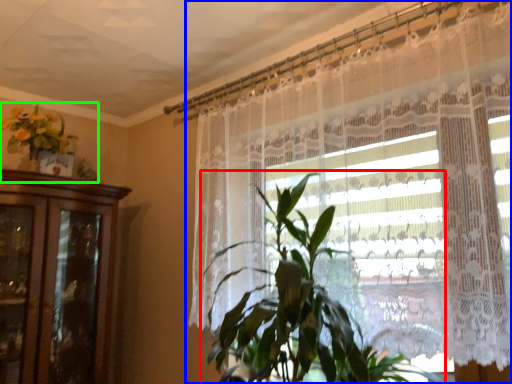
Question: Which object is the closest to the houseplant (highlighted by a red box)? Choose among these: curtain (highlighted by a blue box) or floral arrangement (highlighted by a green box).

Choices:
 (A) curtain
 (B) floral arrangement

Answer: (A)